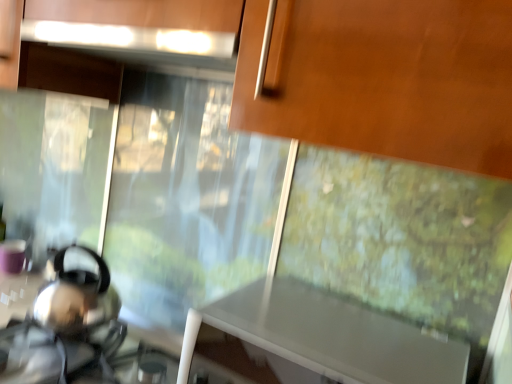
Where is `empty space that is ontop of white glossy table at center (from a real-world perspective)`? empty space that is ontop of white glossy table at center (from a real-world perspective) is located at coordinates (334, 335).